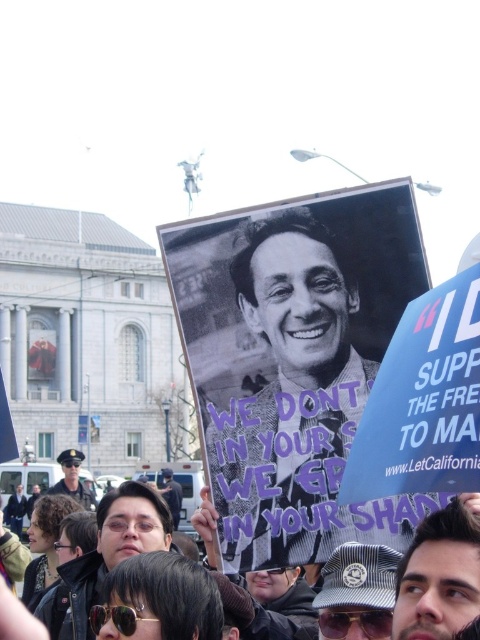
You are a photographer at the protest scene. You want to capture a photo of the black paper poster at center and the matte black sunglasses at center without any obstruction. Based on their positions, which object should you focus on first to ensure both are in frame?

The black paper poster at center is located above matte black sunglasses at center, so you should focus on the matte black sunglasses at center first to ensure both are in frame.

You are a photographer trying to capture a clear shot of the black paper poster at center and the matte black sunglasses at center. Since you want to focus on both objects equally, which object should you adjust your camera focus on first to ensure both are in frame?

The black paper poster at center is larger in width than the matte black sunglasses at center. To ensure both are in frame, focus on the larger object first, which is the black paper poster at center.

You are a photographer trying to capture the large sign in the foreground without any obstruction. There is a uniformed officer at center in the scene. Based on their position, can you determine if the officer is blocking your view of the sign?

The uniformed officer at center is positioned at point (72,480), which is likely blocking the view of the large sign in the foreground since the officer is centrally located and the sign is in the foreground. Adjust your angle to avoid the officer.